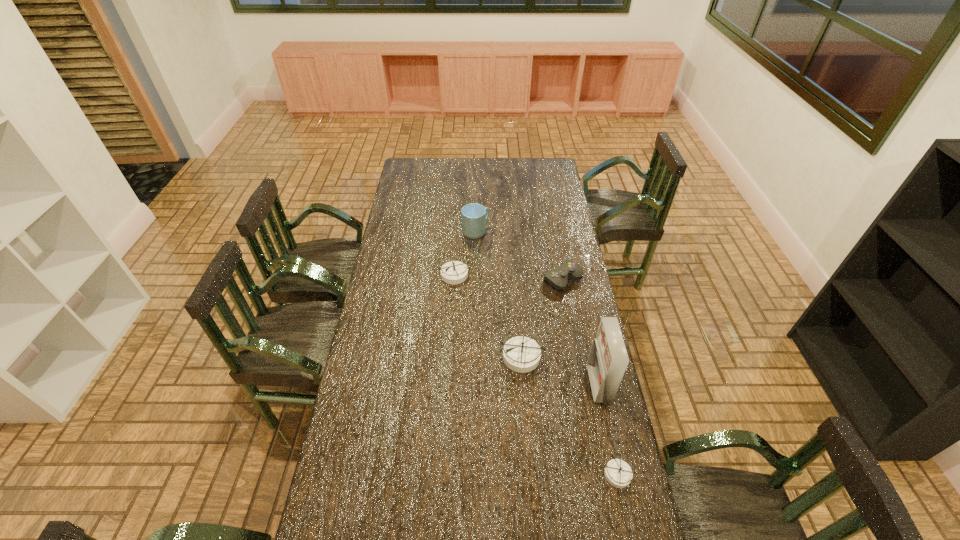
Locate an element on the screen. The width and height of the screenshot is (960, 540). vacant point that satisfies the following two spatial constraints: 1. on the front side of the second tallest object; 2. on the right side of the second compass from left to right is located at coordinates (474, 356).

Where is `vacant space that satisfies the following two spatial constraints: 1. on the front-facing side of the nearest object; 2. on the right side of the first-aid kit`? Image resolution: width=960 pixels, height=540 pixels. vacant space that satisfies the following two spatial constraints: 1. on the front-facing side of the nearest object; 2. on the right side of the first-aid kit is located at coordinates click(x=617, y=474).

Identify the location of vacant space that satisfies the following two spatial constraints: 1. on the front-facing side of the rightmost compass; 2. on the right side of the tallest object. The image size is (960, 540). (617, 474).

This screenshot has width=960, height=540. Find the location of `vacant region that satisfies the following two spatial constraints: 1. on the front-facing side of the first-aid kit; 2. on the right side of the nearest object`. vacant region that satisfies the following two spatial constraints: 1. on the front-facing side of the first-aid kit; 2. on the right side of the nearest object is located at coordinates (617, 474).

Where is `free spot that satisfies the following two spatial constraints: 1. on the front-facing side of the first-aid kit; 2. on the right side of the nearest object`? free spot that satisfies the following two spatial constraints: 1. on the front-facing side of the first-aid kit; 2. on the right side of the nearest object is located at coordinates (617, 474).